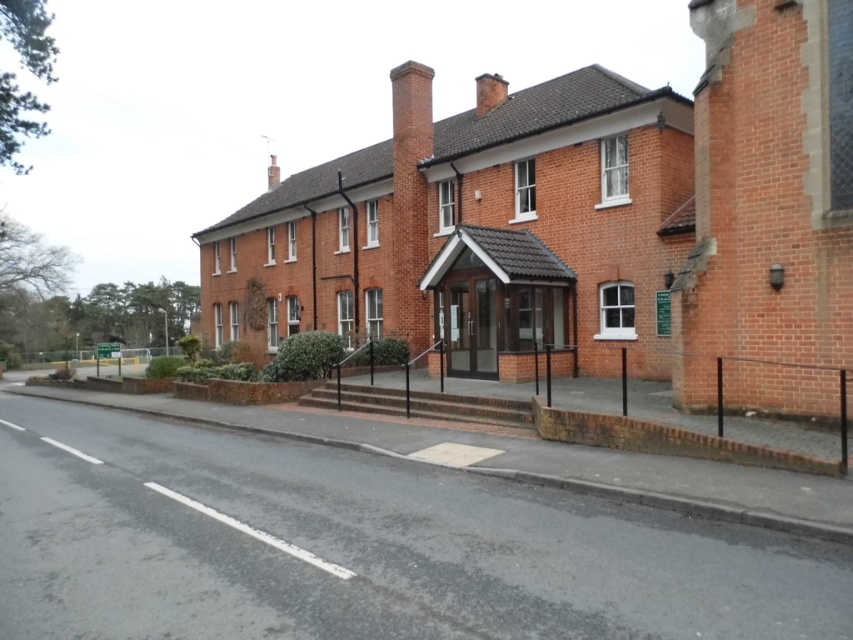
Who is lower down, red brick chimney at center or brick chimney at upper center?

red brick chimney at center is lower down.

Can you confirm if red brick chimney at center is thinner than brick chimney at upper center?

Yes.

Does point (421, 80) come behind point (273, 156)?

No, (421, 80) is closer to viewer.

At what (x,y) coordinates should I click in order to perform the action: click on red brick chimney at center. Please return your answer as a coordinate pair (x, y). The image size is (853, 640). Looking at the image, I should click on (410, 196).